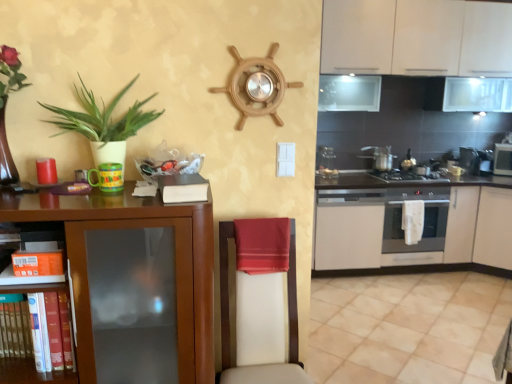
The image size is (512, 384). Identify the location of free spot in front of matte plastic cup at left, the 1th appliance when ordered from left to right. (84, 206).